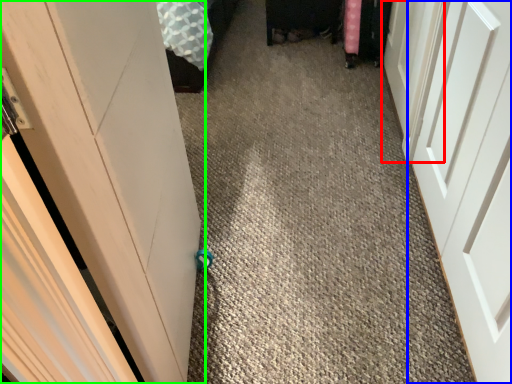
Question: Considering the real-world distances, which object is farthest from door (highlighted by a red box)? door (highlighted by a blue box) or door (highlighted by a green box)?

Choices:
 (A) door
 (B) door

Answer: (B)